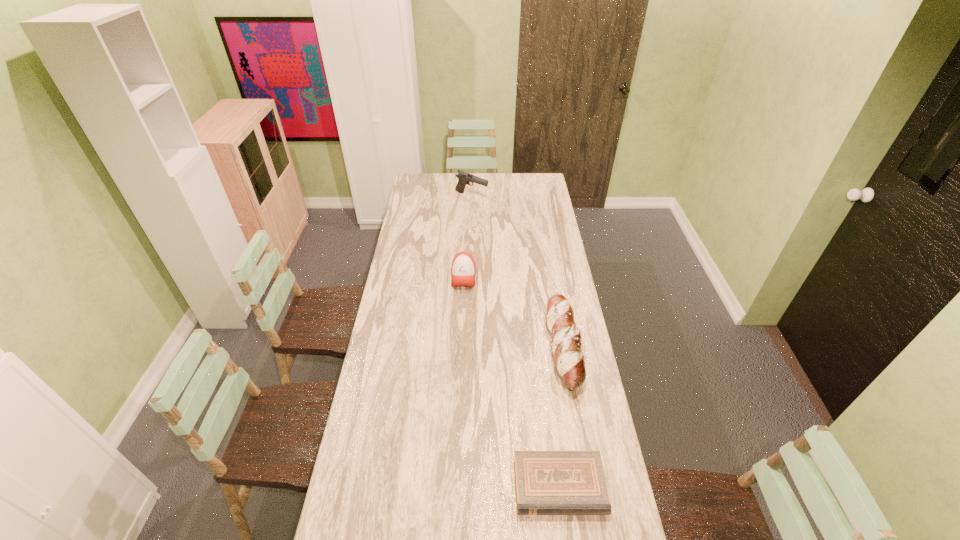
Where is `the tallest object`? The width and height of the screenshot is (960, 540). the tallest object is located at coordinates (464, 178).

Where is `the farthest object`? Image resolution: width=960 pixels, height=540 pixels. the farthest object is located at coordinates (464, 178).

This screenshot has width=960, height=540. Identify the location of the third nearest object. (463, 265).

Locate an element on the screen. The image size is (960, 540). baguet is located at coordinates (569, 361).

The image size is (960, 540). Identify the location of the shortest object. (547, 482).

Find the location of a particular element. This screenshot has height=540, width=960. Bible is located at coordinates (547, 482).

Locate an element on the screen. This screenshot has height=540, width=960. vacant space situated 0.310m at the muzzle of the gun is located at coordinates (540, 197).

Find the location of a particular element. The width and height of the screenshot is (960, 540). vacant position located 0.290m on the front-facing side of the baseball cap is located at coordinates [x=461, y=339].

Find the location of a particular element. The height and width of the screenshot is (540, 960). free region located 0.110m on the left of the baguet is located at coordinates (520, 347).

Locate an element on the screen. object positioned at the far edge is located at coordinates (464, 178).